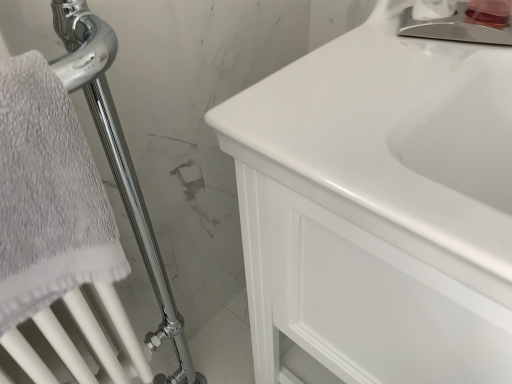
This screenshot has height=384, width=512. What are the coordinates of `free location in front of polished chrome faucet at upper right` in the screenshot? It's located at (444, 74).